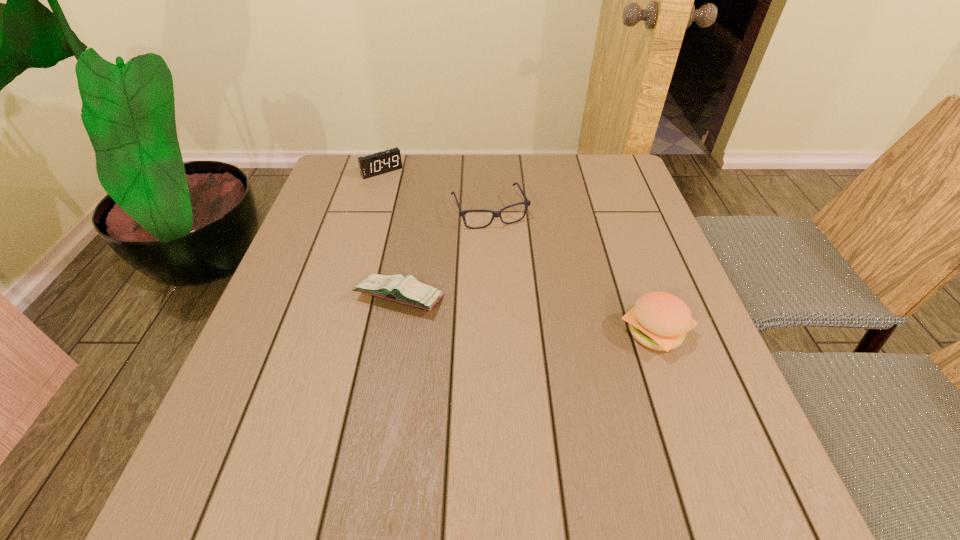
I want to click on vacant space on the desktop that is between the diary and the hamburger and is positioned on the front-facing side of the farthest object, so click(x=491, y=310).

This screenshot has width=960, height=540. I want to click on vacant space on the desktop that is between the diary and the tallest object and is positioned on the front-facing side of the third nearest object, so click(537, 316).